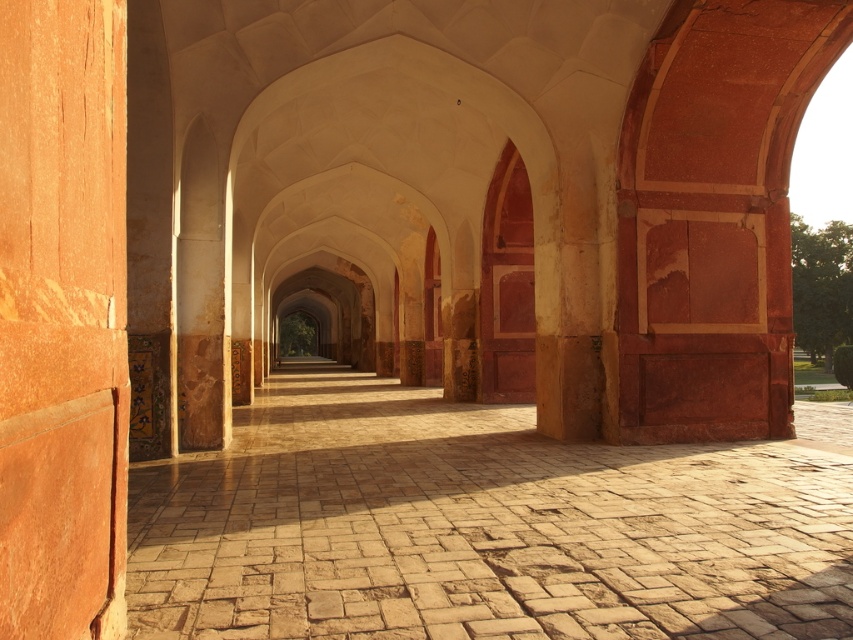
You are standing at the entrance of the corridor and want to walk to the open area at the far end. You notice the brown stone path at center and the smooth orange stone pillar at left. Which object is closer to you as you start walking?

The brown stone path at center is closer to you because it is shorter than the smooth orange stone pillar at left, meaning it is positioned nearer to your starting point.

You are standing in the corridor and want to walk along the brown stone path at center. Will you have to go around the smooth orange stone pillar at left, or can you walk straight?

The brown stone path at center is positioned under the smooth orange stone pillar at left, so you can walk straight along the brown stone path at center without needing to go around the smooth orange stone pillar at left.

You are standing at the entrance of the corridor and want to walk towards the open area at the far end. Which direction should you head relative to the brown stone path at center?

The brown stone path at center is positioned at coordinates point (479,525), so you should head towards the brown stone path at center as it is centrally located and leads towards the open area at the far end.